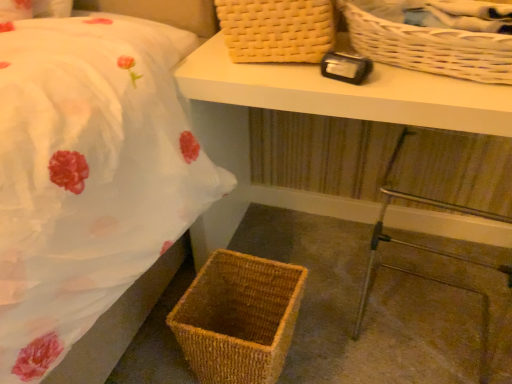
The height and width of the screenshot is (384, 512). What are the coordinates of `white wicker picnic basket at upper right, which appears as the second picnic basket when ordered from the bottom` in the screenshot? It's located at (425, 43).

This screenshot has width=512, height=384. What do you see at coordinates (277, 30) in the screenshot?
I see `woven beige picnic basket at upper center, which appears as the third picnic basket when ordered from the bottom` at bounding box center [277, 30].

Where is `brown woven picnic basket at lower left, the 1th picnic basket ordered from the bottom`? The image size is (512, 384). brown woven picnic basket at lower left, the 1th picnic basket ordered from the bottom is located at coordinates (238, 318).

From a real-world perspective, relative to white wicker picnic basket at upper right, which appears as the second picnic basket when ordered from the bottom, is woven wicker basket at lower left vertically above or below?

woven wicker basket at lower left is situated lower than white wicker picnic basket at upper right, which appears as the second picnic basket when ordered from the bottom, in the real world.

You are a GUI agent. You are given a task and a screenshot of the screen. Output one action in this format:
    pyautogui.click(x=<x>, y=<y>)
    Task: Click on the picnic basket in front of the woven wicker basket at lower left
    This screenshot has width=512, height=384.
    Given the screenshot: What is the action you would take?
    coord(425,43)

Between woven wicker basket at lower left and white wicker picnic basket at upper right, which is counted as the second picnic basket, starting from the top, which one has smaller width?

With smaller width is white wicker picnic basket at upper right, which is counted as the second picnic basket, starting from the top.

Considering the positions of objects woven wicker basket at lower left and white wicker picnic basket at upper right, which appears as the second picnic basket when ordered from the bottom, in the image provided, who is more to the right, woven wicker basket at lower left or white wicker picnic basket at upper right, which appears as the second picnic basket when ordered from the bottom,?

Result: white wicker picnic basket at upper right, which appears as the second picnic basket when ordered from the bottom.

Which is more to the right, white wicker picnic basket at upper right, which appears as the second picnic basket when ordered from the bottom, or brown woven picnic basket at lower left, the 1th picnic basket ordered from the bottom?

From the viewer's perspective, white wicker picnic basket at upper right, which appears as the second picnic basket when ordered from the bottom, appears more on the right side.

Looking at this image, between white wicker picnic basket at upper right, which is counted as the second picnic basket, starting from the top, and brown woven picnic basket at lower left, the 1th picnic basket ordered from the bottom, which one has smaller width?

brown woven picnic basket at lower left, the 1th picnic basket ordered from the bottom.

Between point (457, 52) and point (274, 287), which one is positioned behind?

Point (274, 287)

Based on the photo, from a real-world perspective, does white wicker picnic basket at upper right, which is counted as the second picnic basket, starting from the top, stand above brown woven picnic basket at lower left, the 1th picnic basket ordered from the bottom?

Indeed, from a real-world perspective, white wicker picnic basket at upper right, which is counted as the second picnic basket, starting from the top, stands above brown woven picnic basket at lower left, the 1th picnic basket ordered from the bottom.

Is white wicker picnic basket at upper right, which appears as the second picnic basket when ordered from the bottom, bigger or smaller than woven wicker basket at lower left?

Considering their sizes, white wicker picnic basket at upper right, which appears as the second picnic basket when ordered from the bottom, takes up less space than woven wicker basket at lower left.

In terms of height, does white wicker picnic basket at upper right, which appears as the second picnic basket when ordered from the bottom, look taller or shorter compared to woven wicker basket at lower left?

Considering their sizes, white wicker picnic basket at upper right, which appears as the second picnic basket when ordered from the bottom, has more height than woven wicker basket at lower left.

From the image's perspective, is white wicker picnic basket at upper right, which appears as the second picnic basket when ordered from the bottom, located above or below woven wicker basket at lower left?

white wicker picnic basket at upper right, which appears as the second picnic basket when ordered from the bottom, is situated higher than woven wicker basket at lower left in the image.

The image size is (512, 384). I want to click on picnic basket on the right of woven wicker basket at lower left, so click(425, 43).

Consider the image. Is woven beige picnic basket at upper center, arranged as the first picnic basket when viewed from the top, surrounding white wicker picnic basket at upper right, which is counted as the second picnic basket, starting from the top?

No, white wicker picnic basket at upper right, which is counted as the second picnic basket, starting from the top, is located outside of woven beige picnic basket at upper center, arranged as the first picnic basket when viewed from the top.

Between woven beige picnic basket at upper center, arranged as the first picnic basket when viewed from the top, and white wicker picnic basket at upper right, which appears as the second picnic basket when ordered from the bottom, which one has larger width?

With larger width is white wicker picnic basket at upper right, which appears as the second picnic basket when ordered from the bottom.

Looking at this image, is woven beige picnic basket at upper center, arranged as the first picnic basket when viewed from the top, turned away from white wicker picnic basket at upper right, which appears as the second picnic basket when ordered from the bottom?

woven beige picnic basket at upper center, arranged as the first picnic basket when viewed from the top, does not have its back to white wicker picnic basket at upper right, which appears as the second picnic basket when ordered from the bottom.

Between metallic silver step stool at lower right and woven wood table at center, which one has larger size?

Bigger between the two is woven wood table at center.

Can we say metallic silver step stool at lower right lies outside woven wood table at center?

That's incorrect, metallic silver step stool at lower right is not completely outside woven wood table at center.

Is point (467, 208) farther from camera compared to point (243, 133)?

No, (467, 208) is in front of (243, 133).

From a real-world perspective, is metallic silver step stool at lower right physically located above or below woven wood table at center?

metallic silver step stool at lower right is below woven wood table at center.

Would you say woven wood table at center is to the left or to the right of white wicker picnic basket at upper right, which is counted as the second picnic basket, starting from the top, in the picture?

woven wood table at center is positioned on white wicker picnic basket at upper right, which is counted as the second picnic basket, starting from the top,'s left side.

From a real-world perspective, is woven wood table at center under white wicker picnic basket at upper right, which is counted as the second picnic basket, starting from the top?

Yes, from a real-world perspective, woven wood table at center is under white wicker picnic basket at upper right, which is counted as the second picnic basket, starting from the top.

Which of these two, woven wood table at center or white wicker picnic basket at upper right, which is counted as the second picnic basket, starting from the top, is smaller?

white wicker picnic basket at upper right, which is counted as the second picnic basket, starting from the top.

Considering the relative sizes of metallic silver step stool at lower right and white wicker picnic basket at upper right, which appears as the second picnic basket when ordered from the bottom, in the image provided, is metallic silver step stool at lower right wider than white wicker picnic basket at upper right, which appears as the second picnic basket when ordered from the bottom,?

Incorrect, the width of metallic silver step stool at lower right does not surpass that of white wicker picnic basket at upper right, which appears as the second picnic basket when ordered from the bottom.

Is metallic silver step stool at lower right with white wicker picnic basket at upper right, which appears as the second picnic basket when ordered from the bottom?

No, metallic silver step stool at lower right is not making contact with white wicker picnic basket at upper right, which appears as the second picnic basket when ordered from the bottom.

Measure the distance between metallic silver step stool at lower right and white wicker picnic basket at upper right, which is counted as the second picnic basket, starting from the top.

The distance of metallic silver step stool at lower right from white wicker picnic basket at upper right, which is counted as the second picnic basket, starting from the top, is 15.40 inches.

From a real-world perspective, does metallic silver step stool at lower right sit lower than white wicker picnic basket at upper right, which appears as the second picnic basket when ordered from the bottom?

Yes, from a real-world perspective, metallic silver step stool at lower right is beneath white wicker picnic basket at upper right, which appears as the second picnic basket when ordered from the bottom.

At what (x,y) coordinates should I click in order to perform the action: click on concrete directly beneath the white wicker picnic basket at upper right, which is counted as the second picnic basket, starting from the top (from a real-world perspective). Please return your answer as a coordinate pair (x, y). Looking at the image, I should click on (376, 304).

From the white wicker picnic basket at upper right, which appears as the second picnic basket when ordered from the bottom, count the 2nd picnic basket to the left and point to it. Please provide its 2D coordinates.

[(238, 318)]

Based on their spatial positions, is woven wicker basket at lower left or woven wood table at center further from brown woven picnic basket at lower left, the 1th picnic basket ordered from the bottom?

woven wood table at center is positioned further to the anchor brown woven picnic basket at lower left, the 1th picnic basket ordered from the bottom.

Based on their spatial positions, is woven beige picnic basket at upper center, arranged as the first picnic basket when viewed from the top, or metallic silver step stool at lower right closer to brown woven picnic basket at lower left, the 1th picnic basket ordered from the bottom?

Based on the image, metallic silver step stool at lower right appears to be nearer to brown woven picnic basket at lower left, the 1th picnic basket ordered from the bottom.

Based on their spatial positions, is woven wicker basket at lower left or brown woven picnic basket at lower left, the 1th picnic basket ordered from the bottom, closer to woven beige picnic basket at upper center, which appears as the third picnic basket when ordered from the bottom?

Based on the image, brown woven picnic basket at lower left, the 1th picnic basket ordered from the bottom, appears to be nearer to woven beige picnic basket at upper center, which appears as the third picnic basket when ordered from the bottom.

Looking at the image, which one is located further to white wicker picnic basket at upper right, which is counted as the second picnic basket, starting from the top, woven beige picnic basket at upper center, which appears as the third picnic basket when ordered from the bottom, or woven wood table at center?

Based on the image, woven wood table at center appears to be further to white wicker picnic basket at upper right, which is counted as the second picnic basket, starting from the top.

Based on their spatial positions, is white wicker picnic basket at upper right, which is counted as the second picnic basket, starting from the top, or metallic silver step stool at lower right closer to brown woven picnic basket at lower left, the 1th picnic basket ordered from the bottom?

Based on the image, metallic silver step stool at lower right appears to be nearer to brown woven picnic basket at lower left, the 1th picnic basket ordered from the bottom.

Considering their positions, is woven wicker basket at lower left positioned closer to metallic silver step stool at lower right than brown woven picnic basket at lower left, the 3th picnic basket positioned from the top?

woven wicker basket at lower left is positioned closer to the anchor metallic silver step stool at lower right.

Based on their spatial positions, is metallic silver step stool at lower right or brown woven picnic basket at lower left, the 1th picnic basket ordered from the bottom, further from woven wood table at center?

brown woven picnic basket at lower left, the 1th picnic basket ordered from the bottom, is further to woven wood table at center.

Estimate the real-world distances between objects in this image. Which object is further from woven wicker basket at lower left, brown woven picnic basket at lower left, the 3th picnic basket positioned from the top, or white wicker picnic basket at upper right, which is counted as the second picnic basket, starting from the top?

white wicker picnic basket at upper right, which is counted as the second picnic basket, starting from the top.

I want to click on picnic basket between woven beige picnic basket at upper center, arranged as the first picnic basket when viewed from the top, and woven wicker basket at lower left, in the vertical direction, so click(x=425, y=43).

Where is `step stool between woven beige picnic basket at upper center, arranged as the first picnic basket when viewed from the top, and brown woven picnic basket at lower left, the 3th picnic basket positioned from the top, in the up-down direction`? The image size is (512, 384). step stool between woven beige picnic basket at upper center, arranged as the first picnic basket when viewed from the top, and brown woven picnic basket at lower left, the 3th picnic basket positioned from the top, in the up-down direction is located at coordinates (411, 243).

Find the location of `step stool between white wicker picnic basket at upper right, which is counted as the second picnic basket, starting from the top, and brown woven picnic basket at lower left, the 3th picnic basket positioned from the top, from top to bottom`. step stool between white wicker picnic basket at upper right, which is counted as the second picnic basket, starting from the top, and brown woven picnic basket at lower left, the 3th picnic basket positioned from the top, from top to bottom is located at coordinates (411, 243).

You are a GUI agent. You are given a task and a screenshot of the screen. Output one action in this format:
    pyautogui.click(x=<x>, y=<y>)
    Task: Click on the step stool between woven wood table at center and woven wicker basket at lower left vertically
    Image resolution: width=512 pixels, height=384 pixels.
    Given the screenshot: What is the action you would take?
    pyautogui.click(x=411, y=243)